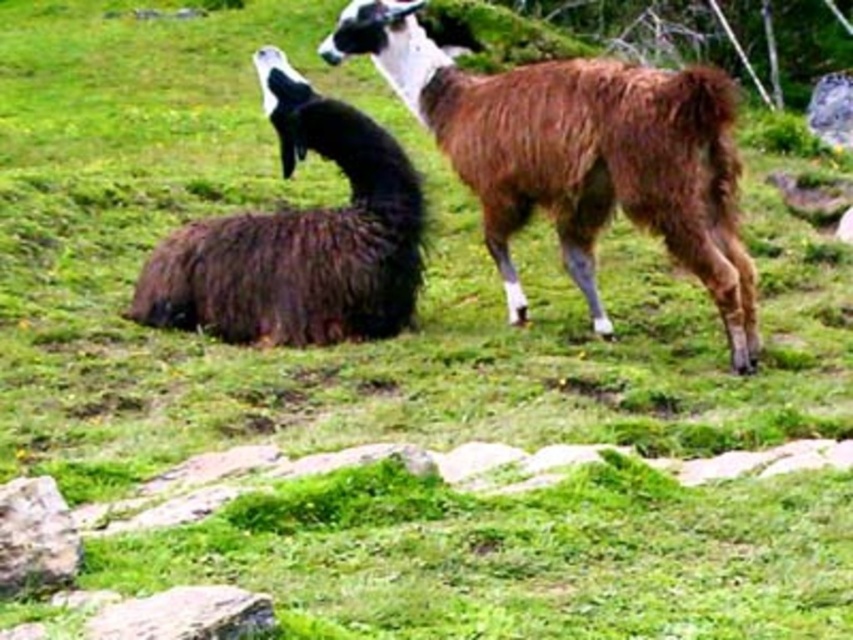
Question: Is brown woolly alpaca at center above dark brown woolen goat at center?

Choices:
 (A) yes
 (B) no

Answer: (A)

Question: Is brown woolly alpaca at center thinner than dark brown woolen goat at center?

Choices:
 (A) yes
 (B) no

Answer: (B)

Question: Which object appears closest to the camera in this image?

Choices:
 (A) dark brown woolen goat at center
 (B) brown woolly alpaca at center

Answer: (B)

Question: Does brown woolly alpaca at center appear under dark brown woolen goat at center?

Choices:
 (A) yes
 (B) no

Answer: (B)